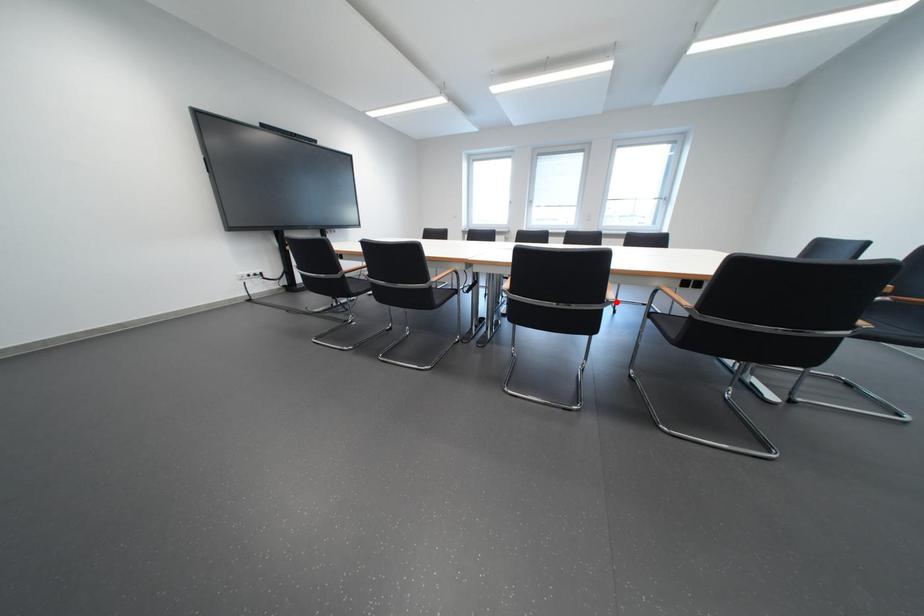
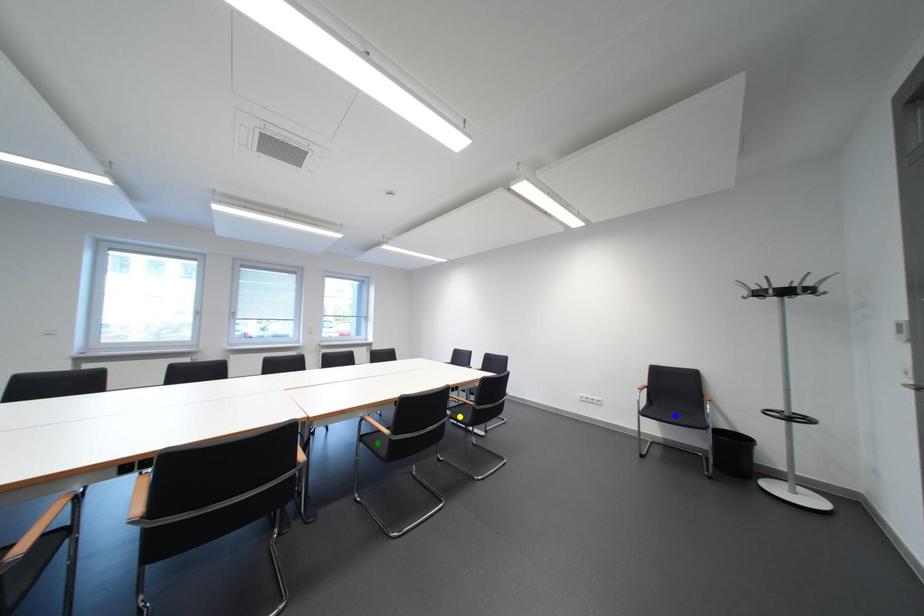
Question: I am providing you with two images of the same scene from different viewpoints. A red point is marked on the first image. You are given multiple points on the second image. In image 2, which mark is for the same physical point as the one in image 1?

Choices:
 (A) green point
 (B) blue point
 (C) yellow point

Answer: (C)